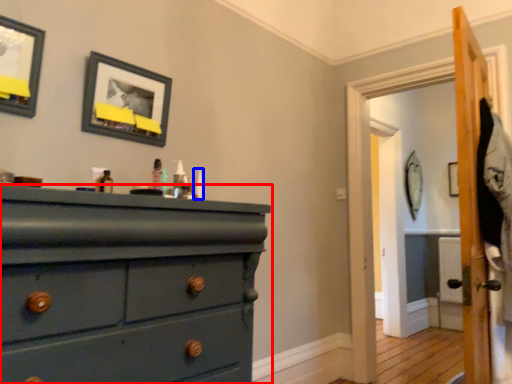
Question: Which object appears farthest to the camera in this image, chest of drawers (highlighted by a red box) or toiletry (highlighted by a blue box)?

Choices:
 (A) chest of drawers
 (B) toiletry

Answer: (B)